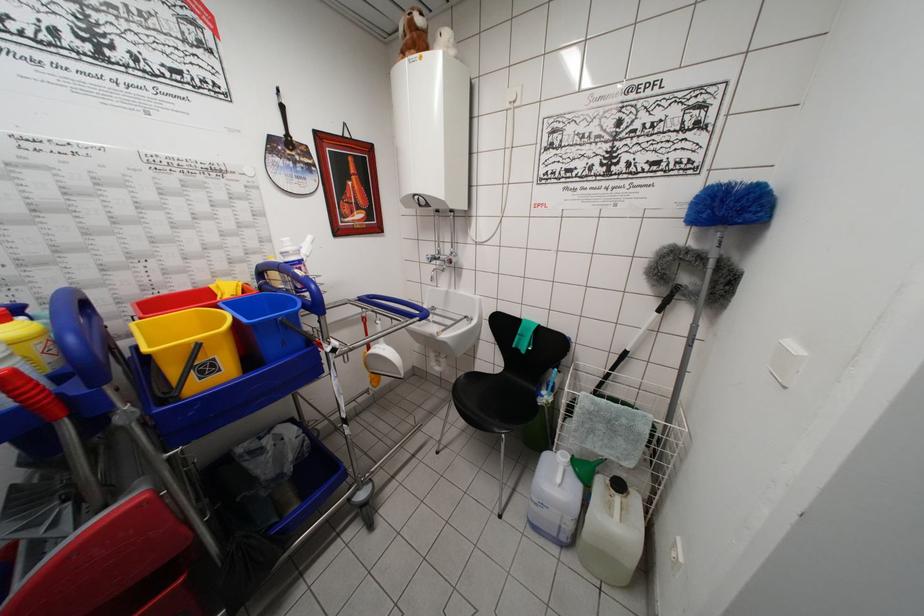
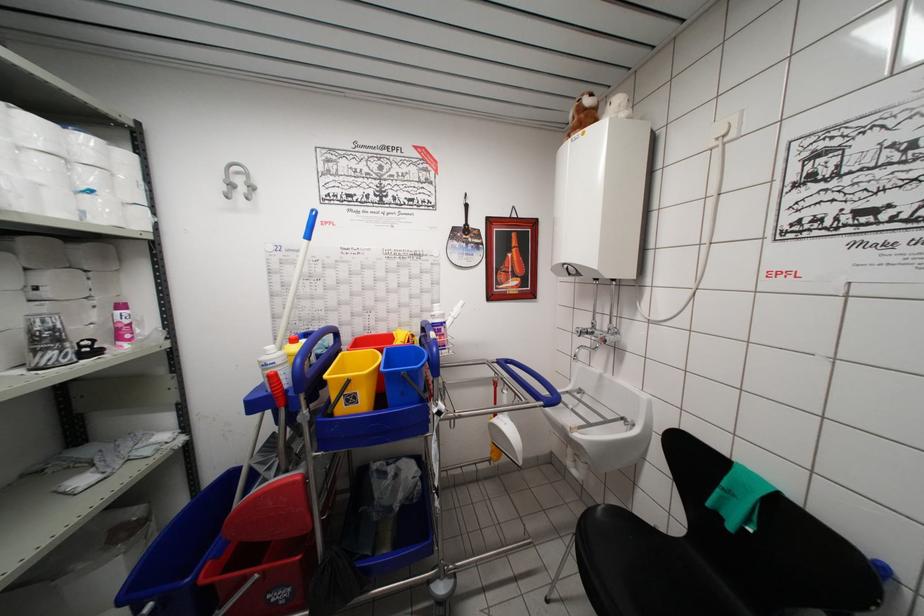
Question: The camera is either moving clockwise (left) or counter-clockwise (right) around the object. The first image is from the beginning of the video and the second image is from the end. Is the camera moving left or right when shooting the video?

Choices:
 (A) Left
 (B) Right

Answer: (B)